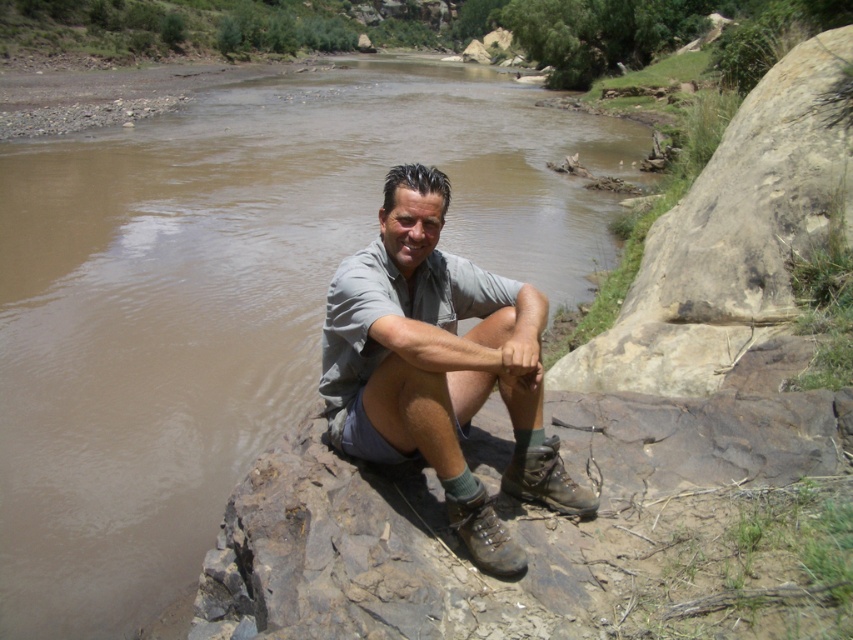
You are a photographer trying to capture the man in the scene. You notice the gray fabric shirt at center and the muddy leather hiking boot at lower center. Which object should you focus on first if you want to ensure both are in frame without moving the camera?

The gray fabric shirt at center is larger in size than the muddy leather hiking boot at lower center, so focusing on the gray fabric shirt at center first will help ensure both are in frame without needing to adjust the camera position.

You are standing at the position of the man in the image. There are two points marked in the scene. One is at point coordinates point (526,493) and the other is at point coordinates point (489,513). Which point is closer to you?

Point (489,513) is closer to you because it is less further to the camera than point (526,493).

You are a photographer trying to capture the man in the scene. You notice the gray fabric shirt at center and the brown leather boot at lower center. Which object should you focus on first if you want to ensure both are in sharp focus?

The gray fabric shirt at center is in front of the brown leather boot at lower center, so you should focus on the gray fabric shirt at center first to ensure both are in sharp focus.